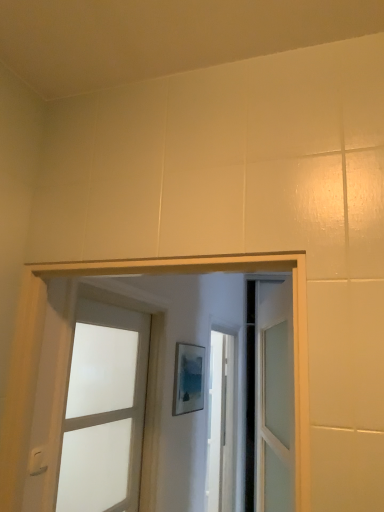
Question: From a real-world perspective, is white frosted glass door at center located beneath white plastic light switch at lower left?

Choices:
 (A) yes
 (B) no

Answer: (B)

Question: From the image's perspective, is white frosted glass door at center below white plastic light switch at lower left?

Choices:
 (A) yes
 (B) no

Answer: (A)

Question: Is white frosted glass door at center positioned behind white plastic light switch at lower left?

Choices:
 (A) no
 (B) yes

Answer: (B)

Question: Does white frosted glass door at center have a greater height compared to white plastic light switch at lower left?

Choices:
 (A) yes
 (B) no

Answer: (A)

Question: Is white frosted glass door at center at the left side of white plastic light switch at lower left?

Choices:
 (A) yes
 (B) no

Answer: (B)

Question: Is the position of white frosted glass door at center less distant than that of white plastic light switch at lower left?

Choices:
 (A) yes
 (B) no

Answer: (B)

Question: From a real-world perspective, is white plastic light switch at lower left physically below white frosted glass door at center?

Choices:
 (A) yes
 (B) no

Answer: (A)

Question: Does white plastic light switch at lower left come behind white frosted glass door at center?

Choices:
 (A) yes
 (B) no

Answer: (B)

Question: Can you see white plastic light switch at lower left touching white frosted glass door at center?

Choices:
 (A) yes
 (B) no

Answer: (B)

Question: Is white plastic light switch at lower left in front of white frosted glass door at center?

Choices:
 (A) no
 (B) yes

Answer: (B)

Question: Is white frosted glass door at center a part of white plastic light switch at lower left?

Choices:
 (A) yes
 (B) no

Answer: (B)

Question: From a real-world perspective, is white plastic light switch at lower left located higher than white frosted glass door at center?

Choices:
 (A) yes
 (B) no

Answer: (B)

Question: Is point (87, 471) positioned closer to the camera than point (36, 455)?

Choices:
 (A) farther
 (B) closer

Answer: (A)